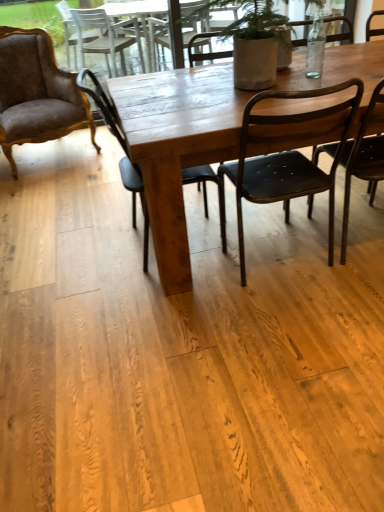
Question: In the image, is black metal chair at center, the third chair in the left-to-right sequence, positioned in front of or behind matte black chair at center, the 3th chair viewed from the right?

Choices:
 (A) behind
 (B) front

Answer: (B)

Question: Considering the positions of black metal chair at center, which is the second chair in right-to-left order, and matte black chair at center, positioned as the 2th chair in left-to-right order, in the image, is black metal chair at center, which is the second chair in right-to-left order, taller or shorter than matte black chair at center, positioned as the 2th chair in left-to-right order,?

Choices:
 (A) short
 (B) tall

Answer: (A)

Question: Which is farther from the velvet brown armchair at left, placed as the 1th chair when sorted from left to right?

Choices:
 (A) wooden table at center
 (B) black metal chair at right, arranged as the fourth chair when viewed from the left
 (C) black metal chair at center, the third chair in the left-to-right sequence
 (D) matte black chair at center, the 3th chair viewed from the right

Answer: (B)

Question: Estimate the real-world distances between objects in this image. Which object is farther from the velvet brown armchair at left, placed as the 1th chair when sorted from left to right?

Choices:
 (A) black metal chair at center, the third chair in the left-to-right sequence
 (B) matte black chair at center, positioned as the 2th chair in left-to-right order
 (C) black metal chair at right, which is counted as the 1th chair, starting from the right
 (D) wooden table at center

Answer: (C)